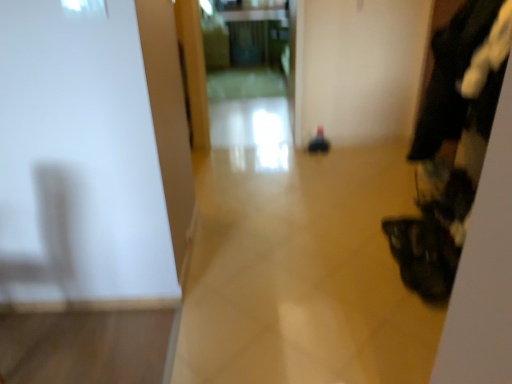
This screenshot has width=512, height=384. I want to click on transparent glass screen door at center, so click(246, 50).

The image size is (512, 384). What do you see at coordinates (246, 50) in the screenshot? I see `transparent glass screen door at center` at bounding box center [246, 50].

Where is `transparent glass screen door at center`? transparent glass screen door at center is located at coordinates (246, 50).